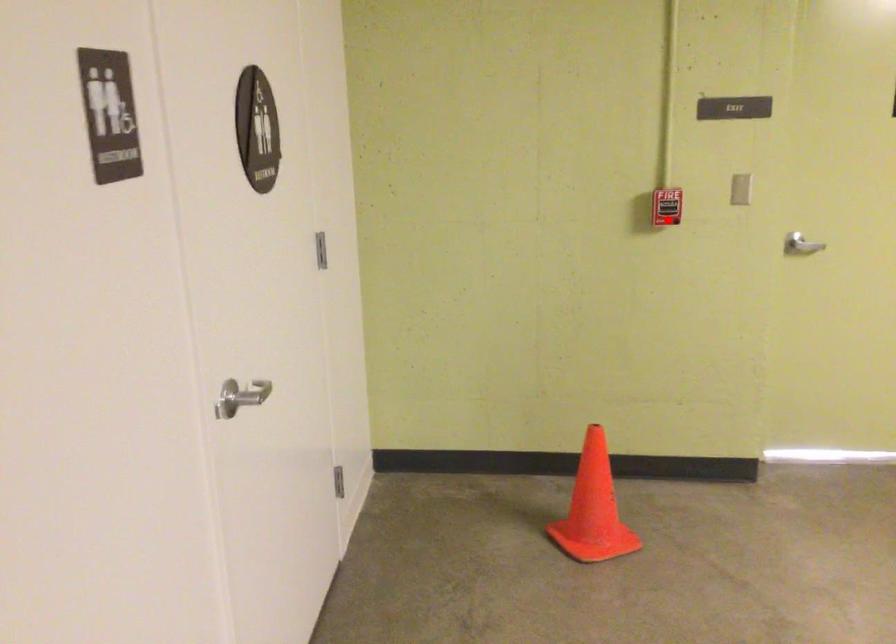
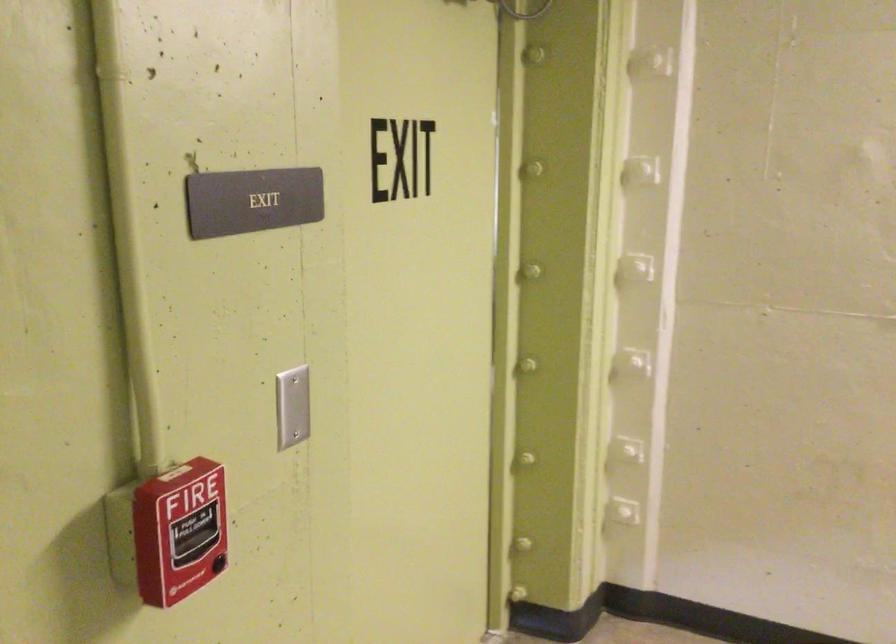
Locate, in the second image, the point that corresponds to the highlighted location in the first image.

(179, 532)